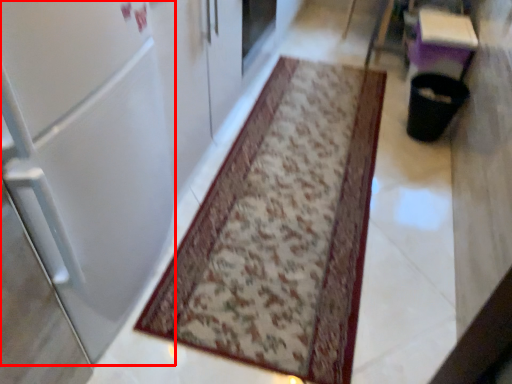
Question: Observing the image, what is the correct spatial positioning of door (annotated by the red box) in reference to mat?

Choices:
 (A) left
 (B) right

Answer: (A)